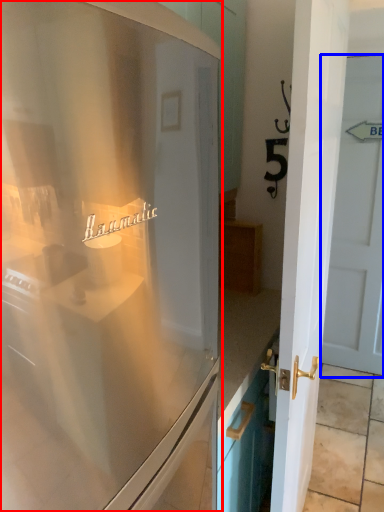
Question: Which object is further to the camera taking this photo, refrigerator (highlighted by a red box) or door (highlighted by a blue box)?

Choices:
 (A) refrigerator
 (B) door

Answer: (B)